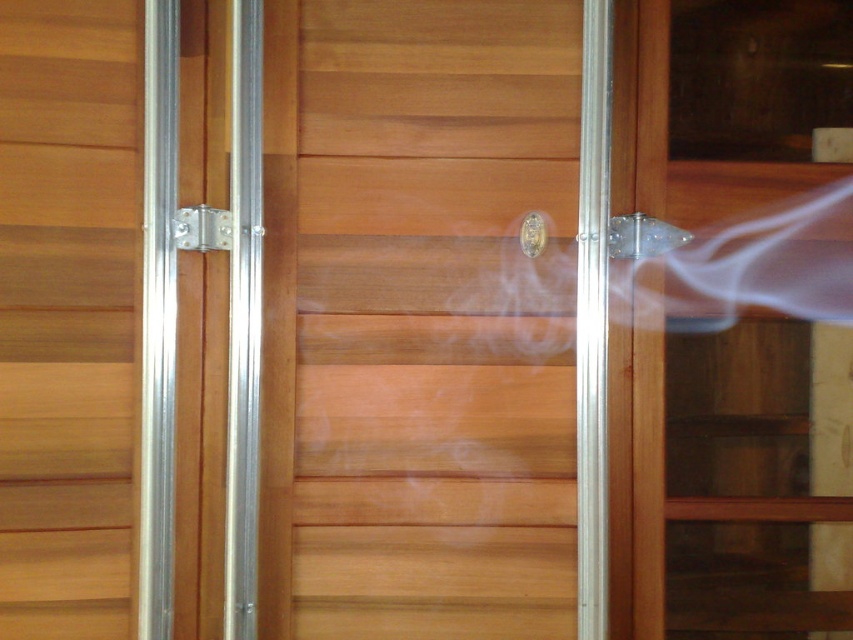
Which is in front, point (299, 83) or point (724, 253)?

Point (299, 83) is more forward.

Who is positioned more to the left, natural wood door at center or white translucent smoke at center?

natural wood door at center is more to the left.

Who is more distant from viewer, [468,442] or [328,308]?

Point [468,442]

Locate an element on the screen. Image resolution: width=853 pixels, height=640 pixels. natural wood door at center is located at coordinates (419, 320).

Does polished brass door handle at center appear over clear plastic lock at center?

Correct, polished brass door handle at center is located above clear plastic lock at center.

Does polished brass door handle at center have a greater width compared to clear plastic lock at center?

Yes.

At what (x,y) coordinates should I click in order to perform the action: click on polished brass door handle at center. Please return your answer as a coordinate pair (x, y). This screenshot has width=853, height=640. Looking at the image, I should click on (642, 236).

Which is more to the left, white translucent smoke at center or silver metallic lock at center?

silver metallic lock at center

Can you confirm if white translucent smoke at center is positioned above silver metallic lock at center?

Actually, white translucent smoke at center is below silver metallic lock at center.

Is point (701, 292) positioned in front of point (210, 218)?

No, it is behind (210, 218).

In order to click on white translucent smoke at center in this screenshot , I will do pos(751,262).